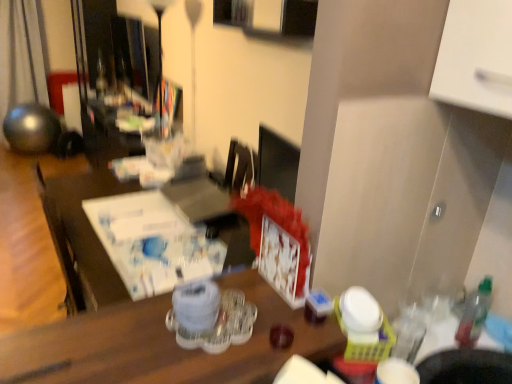
This screenshot has height=384, width=512. I want to click on vacant region above clear plastic tray at center (from a real-world perspective), so (173, 345).